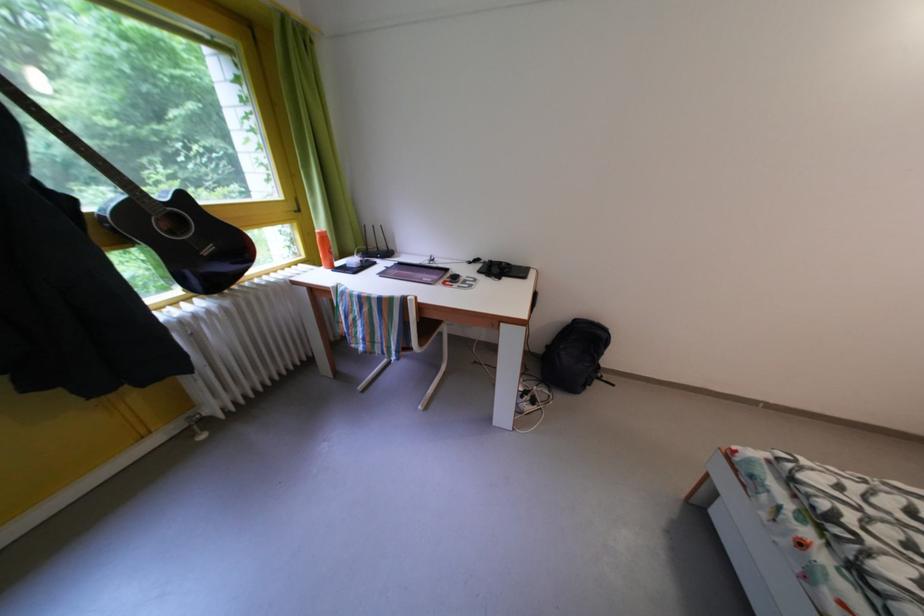
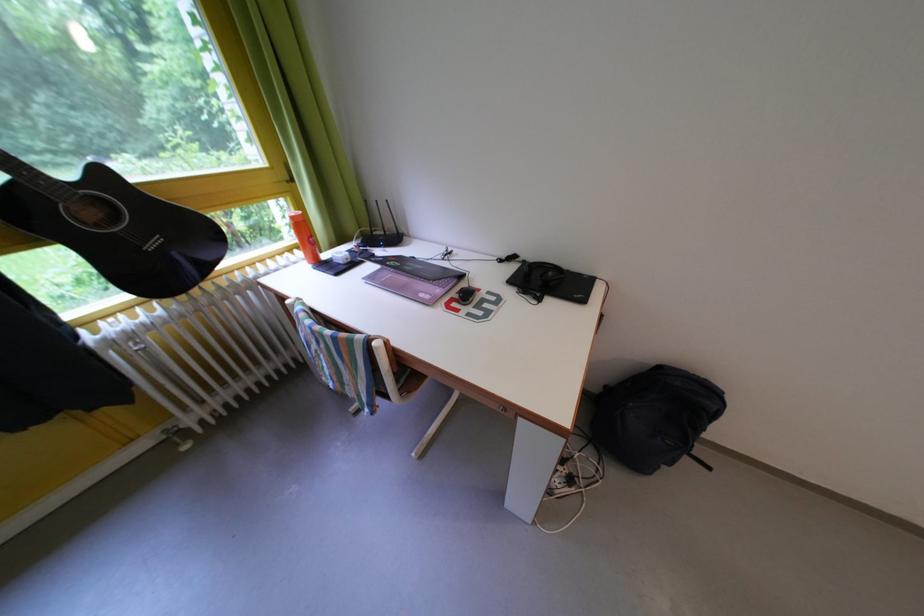
Question: How did the camera likely rotate?

Choices:
 (A) Left
 (B) Right
 (C) Up
 (D) Down

Answer: (A)